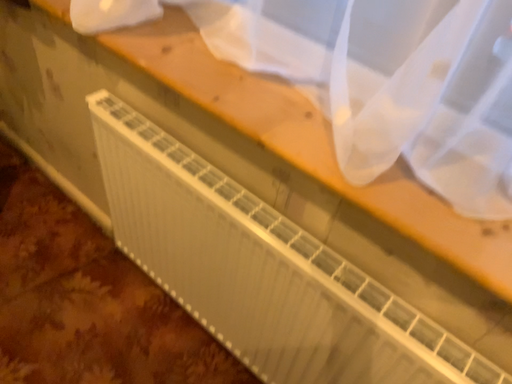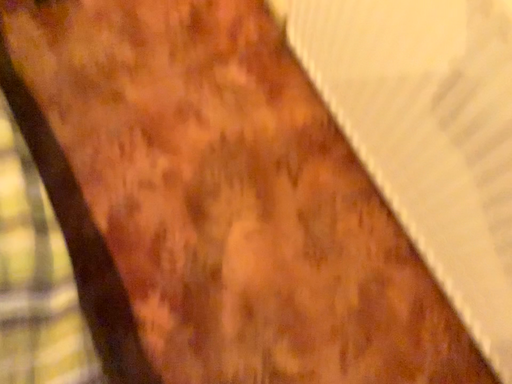
Question: Which way did the camera rotate in the video?

Choices:
 (A) rotated left
 (B) rotated right

Answer: (A)